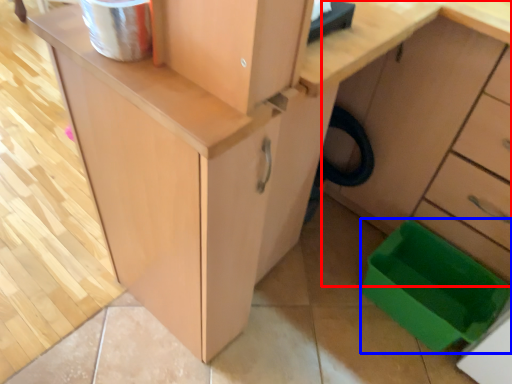
Question: Which point is further to the camera, cabinetry (highlighted by a red box) or storage box (highlighted by a blue box)?

Choices:
 (A) cabinetry
 (B) storage box

Answer: (B)